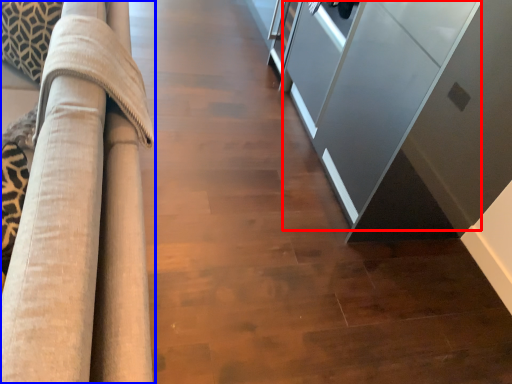
Question: Which object appears farthest to the camera in this image, glass door (highlighted by a red box) or furniture (highlighted by a blue box)?

Choices:
 (A) glass door
 (B) furniture

Answer: (A)